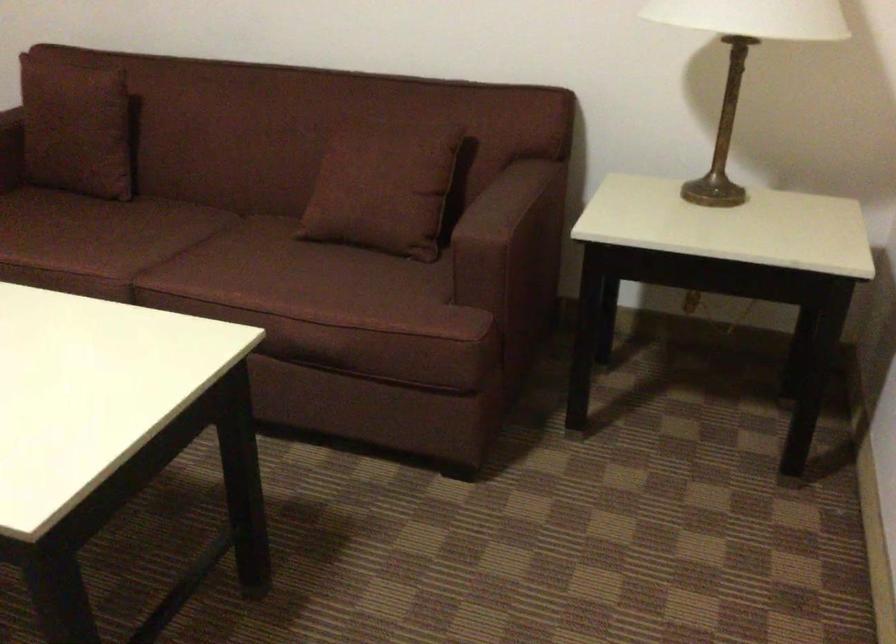
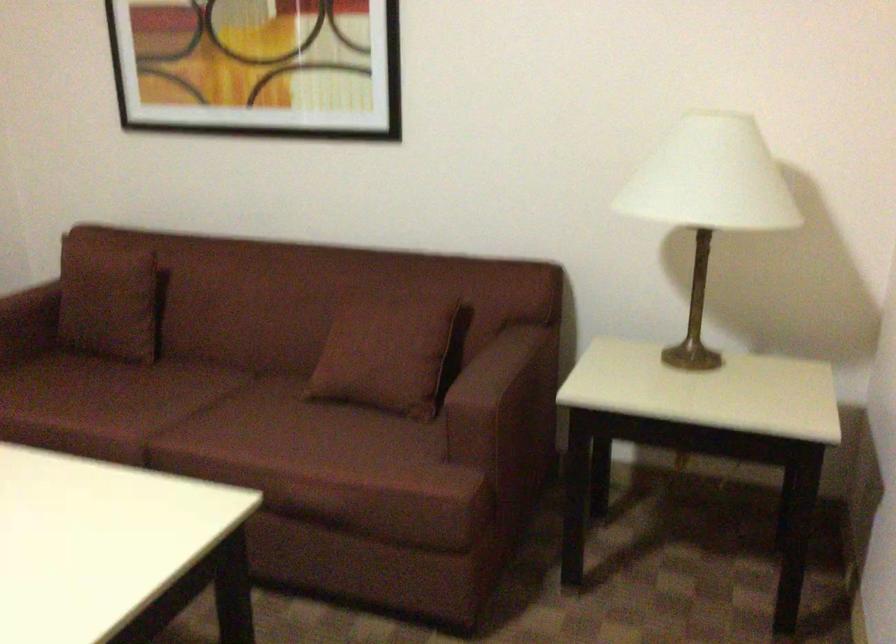
In a continuous first-person perspective shot, in which direction is the camera moving?

The cameraman walked toward right, backward.